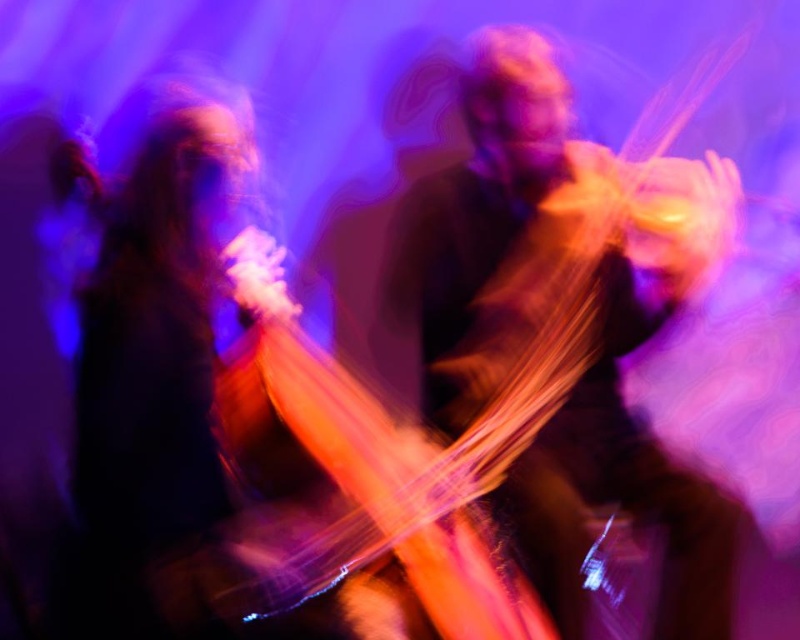
Question: Which object is the closest to the wooden violin at center?

Choices:
 (A) translucent orange cello at center
 (B) shiny black guitar at left

Answer: (A)

Question: Which point appears farthest from the camera in this image?

Choices:
 (A) (362, 392)
 (B) (692, 180)

Answer: (A)

Question: Is shiny black guitar at left closer to the viewer compared to translucent orange cello at center?

Choices:
 (A) yes
 (B) no

Answer: (A)

Question: Is shiny black guitar at left to the right of translucent orange cello at center from the viewer's perspective?

Choices:
 (A) no
 (B) yes

Answer: (A)

Question: Which of the following is the closest to the observer?

Choices:
 (A) (542, 125)
 (B) (204, 374)

Answer: (B)

Question: Does wooden violin at center appear on the right side of translucent orange cello at center?

Choices:
 (A) no
 (B) yes

Answer: (B)